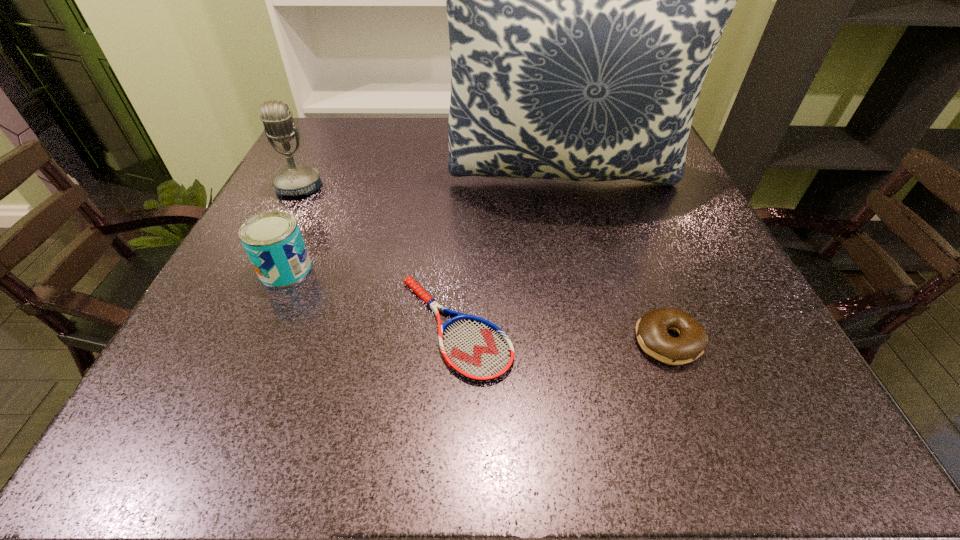
Image resolution: width=960 pixels, height=540 pixels. Find the location of `object that is the second closest one to the tallest object`. object that is the second closest one to the tallest object is located at coordinates (272, 240).

I want to click on vacant space that satisfies the following two spatial constraints: 1. on the front side of the shortest object; 2. on the left side of the third tallest object, so click(x=259, y=327).

The width and height of the screenshot is (960, 540). In order to click on blank space that satisfies the following two spatial constraints: 1. on the front-facing side of the fourth shortest object; 2. on the left side of the tennis racket in this screenshot , I will do `click(228, 327)`.

You are a GUI agent. You are given a task and a screenshot of the screen. Output one action in this format:
    pyautogui.click(x=<x>, y=<y>)
    Task: Click on the free location that satisfies the following two spatial constraints: 1. on the front-facing side of the fourth shortest object; 2. on the right side of the shortest object
    The image size is (960, 540).
    Given the screenshot: What is the action you would take?
    pyautogui.click(x=228, y=327)

Image resolution: width=960 pixels, height=540 pixels. What are the coordinates of `vacant space that satisfies the following two spatial constraints: 1. on the front-facing side of the microphone; 2. on the right side of the doughnut` in the screenshot? It's located at (221, 341).

You are a GUI agent. You are given a task and a screenshot of the screen. Output one action in this format:
    pyautogui.click(x=<x>, y=<y>)
    Task: Click on the free space that satisfies the following two spatial constraints: 1. on the front-facing side of the third shortest object; 2. on the right side of the microphone
    This screenshot has height=540, width=960.
    Given the screenshot: What is the action you would take?
    coord(257,269)